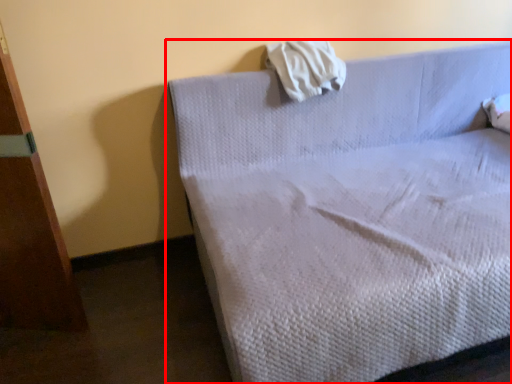
Question: From the image's perspective, what is the correct spatial positioning of bed (annotated by the red box) in reference to cloth?

Choices:
 (A) below
 (B) above

Answer: (A)